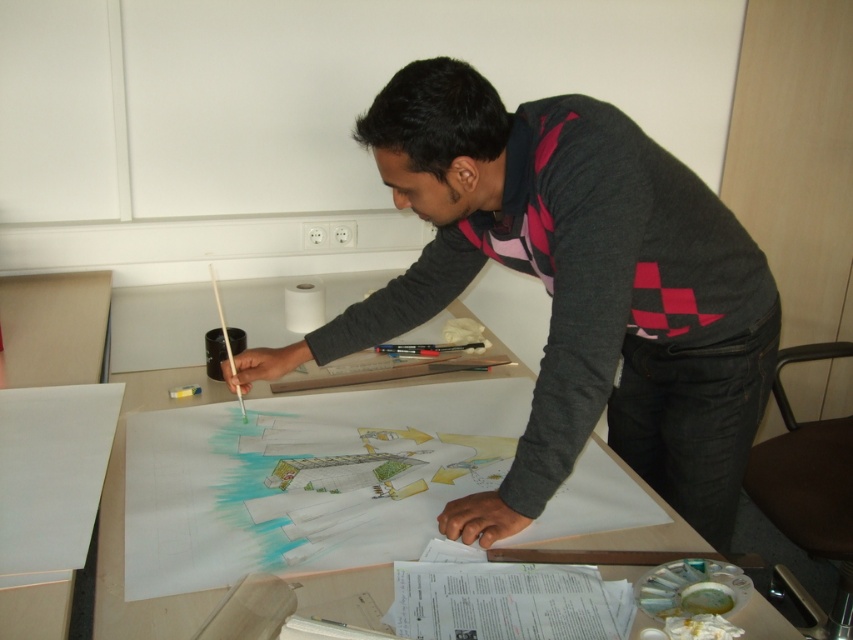
Is white paper at center wider than white matte paper at center?

Indeed, white paper at center has a greater width compared to white matte paper at center.

This screenshot has height=640, width=853. What do you see at coordinates (161, 342) in the screenshot? I see `white paper at center` at bounding box center [161, 342].

Where is `white paper at center`? white paper at center is located at coordinates (161, 342).

Looking at this image, between colored pencil sketch at center and white matte paper at center, which one appears on the left side from the viewer's perspective?

From the viewer's perspective, white matte paper at center appears more on the left side.

Does colored pencil sketch at center have a lesser width compared to white matte paper at center?

No.

The width and height of the screenshot is (853, 640). I want to click on colored pencil sketch at center, so pyautogui.click(x=286, y=492).

Between point (619, 282) and point (289, 307), which one is positioned in front?

Positioned in front is point (619, 282).

Is dark gray sweater at center positioned behind white matte paper at center?

No, it is in front of white matte paper at center.

Identify the location of dark gray sweater at center. This screenshot has width=853, height=640. click(x=573, y=289).